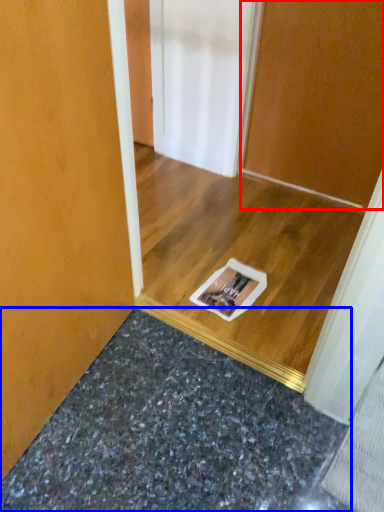
Question: Among these objects, which one is farthest to the camera, door (highlighted by a red box) or granite (highlighted by a blue box)?

Choices:
 (A) door
 (B) granite

Answer: (A)